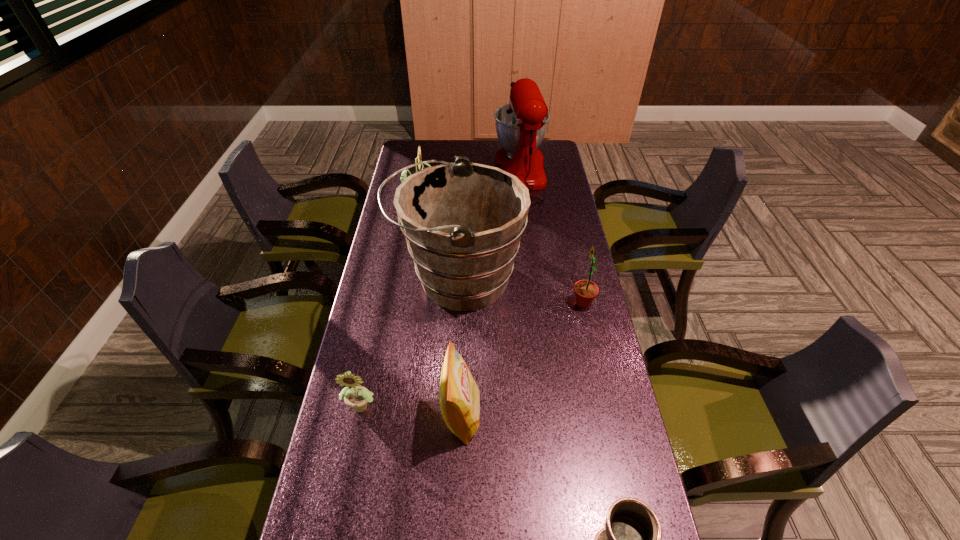
Identify the location of the closest sunflower relative to the smaller yellow sunflower. The width and height of the screenshot is (960, 540). (586, 291).

Identify which sunflower is located as the third nearest to the red mixer. Please provide its 2D coordinates. Your answer should be formatted as a tuple, i.e. [(x, y)], where the tuple contains the x and y coordinates of a point satisfying the conditions above.

[(357, 397)]

The image size is (960, 540). In order to click on vacant space that satisfies the following two spatial constraints: 1. on the face of the second farthest sunflower; 2. on the front-facing side of the nearer yellow sunflower in this screenshot , I will do `click(606, 406)`.